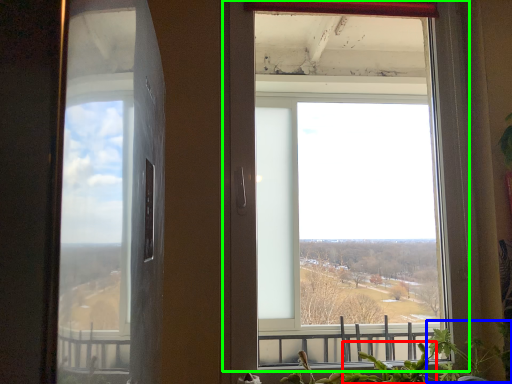
Question: Which is farther away from plant (highlighted by a red box)? plant (highlighted by a blue box) or window (highlighted by a green box)?

Choices:
 (A) plant
 (B) window

Answer: (B)